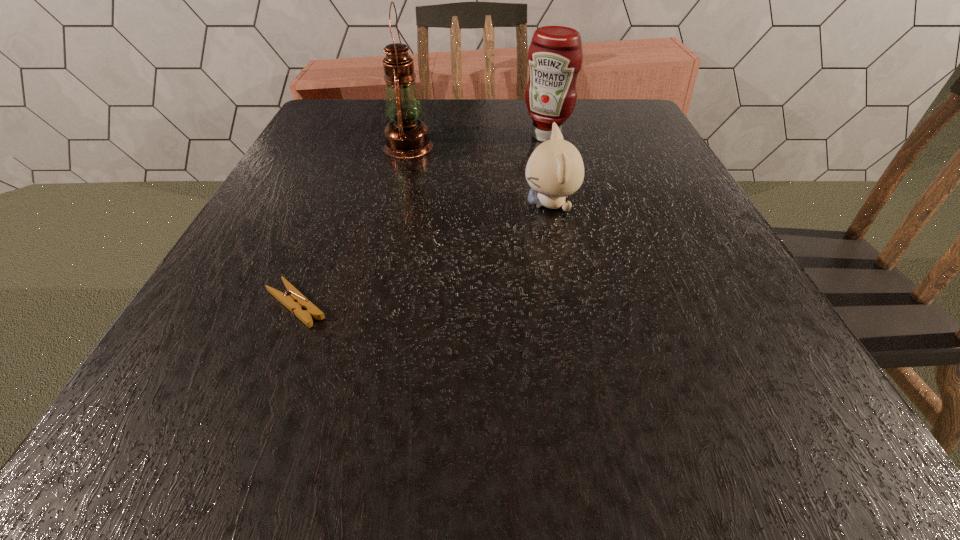
Find the location of a particular element. The image size is (960, 540). the third object from right to left is located at coordinates (406, 136).

You are a GUI agent. You are given a task and a screenshot of the screen. Output one action in this format:
    pyautogui.click(x=<x>, y=<y>)
    Task: Click on the tallest object
    
    Given the screenshot: What is the action you would take?
    [406, 136]

Where is `the third shortest object`? the third shortest object is located at coordinates (555, 56).

Identify the location of kitten. The width and height of the screenshot is (960, 540). (x=555, y=169).

I want to click on the second shortest object, so click(x=555, y=169).

Image resolution: width=960 pixels, height=540 pixels. What are the coordinates of `the shortest object` in the screenshot? It's located at (296, 302).

Where is `the leftmost object`? the leftmost object is located at coordinates click(x=296, y=302).

Identify the location of vacant space located 0.190m on the back of the tallest object. This screenshot has width=960, height=540. [x=420, y=100].

I want to click on free space located 0.280m on the left of the second tallest object, so click(402, 136).

Locate an element on the screen. free space located 0.360m on the face of the third tallest object is located at coordinates (331, 204).